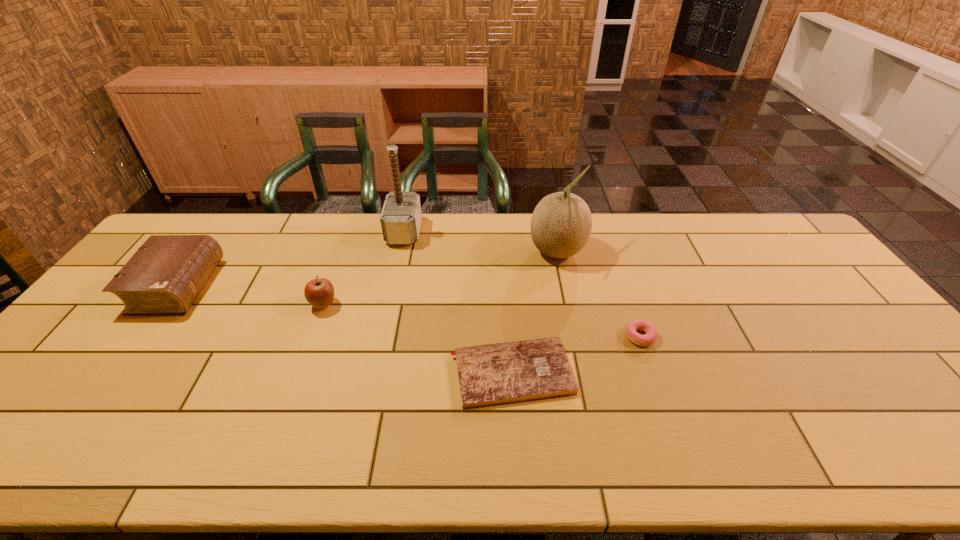
Identify the location of free space that satisfies the following two spatial constraints: 1. on the back side of the rightmost object; 2. for striking with the head of the fourth object from right to left. (603, 232).

Where is `free space that satisfies the following two spatial constraints: 1. on the spine side of the leftmost object; 2. on the left side of the shortest object`? The height and width of the screenshot is (540, 960). free space that satisfies the following two spatial constraints: 1. on the spine side of the leftmost object; 2. on the left side of the shortest object is located at coordinates (113, 373).

Identify the location of free spot that satisfies the following two spatial constraints: 1. on the back side of the doughnut; 2. on the left side of the shortest object. The image size is (960, 540). (509, 336).

The image size is (960, 540). What are the coordinates of `vacant space that satisfies the following two spatial constraints: 1. for striking with the head of the hammer; 2. on the right side of the rightmost object` in the screenshot? It's located at [382, 336].